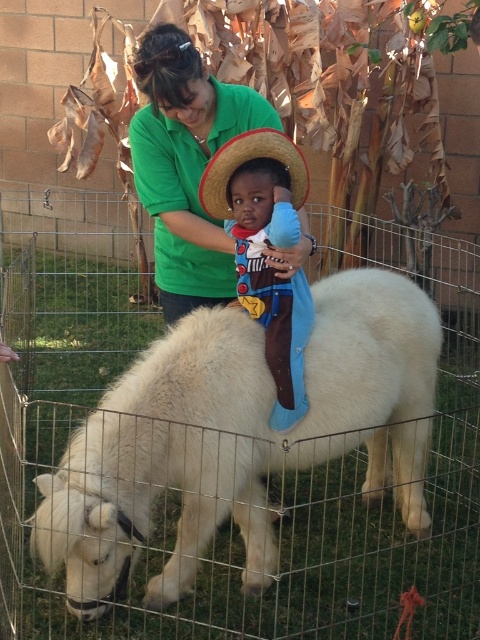
Is white fluffy pony at center behind green cotton shirt at upper center?

No, white fluffy pony at center is closer to the viewer.

In the scene shown: Is white fluffy pony at center shorter than green cotton shirt at upper center?

No.

Who is more distant from viewer, (206, 531) or (193, 236)?

The point (193, 236) is behind.

Find the location of a particular element. This screenshot has width=480, height=640. white fluffy pony at center is located at coordinates (239, 436).

Can you confirm if white fluffy pony at center is taller than strawmaterial/texturehat at upper center?

Indeed, white fluffy pony at center has a greater height compared to strawmaterial/texturehat at upper center.

Which is more to the right, white fluffy pony at center or strawmaterial/texturehat at upper center?

Positioned to the right is white fluffy pony at center.

Is point (207, 508) less distant than point (211, 192)?

No, it is not.

This screenshot has height=640, width=480. What are the coordinates of `white fluffy pony at center` in the screenshot? It's located at (239, 436).

Based on the photo, who is more forward, (166,269) or (273,129)?

Point (273,129) is in front.

Can you confirm if green cotton shirt at upper center is thinner than strawmaterial/texturehat at upper center?

No, green cotton shirt at upper center is not thinner than strawmaterial/texturehat at upper center.

Find the location of a particular element. This screenshot has height=640, width=480. green cotton shirt at upper center is located at coordinates (186, 164).

Where is `green cotton shirt at upper center`? This screenshot has height=640, width=480. green cotton shirt at upper center is located at coordinates (186, 164).